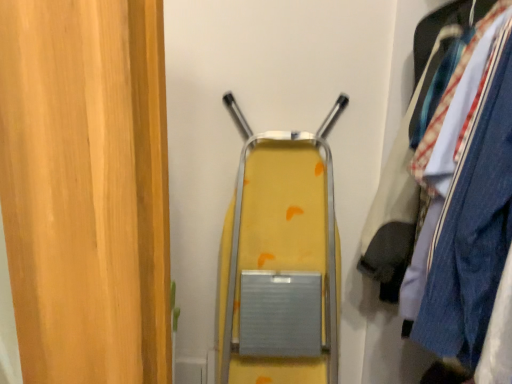
Identify the location of denim jacket at right. This screenshot has height=384, width=512. (400, 176).

This screenshot has height=384, width=512. What do you see at coordinates (400, 176) in the screenshot?
I see `denim jacket at right` at bounding box center [400, 176].

In order to face denim jacket at right, should I rotate leftwards or rightwards?

Rotate your view right by about 31.454°.

I want to click on denim jacket at right, so click(400, 176).